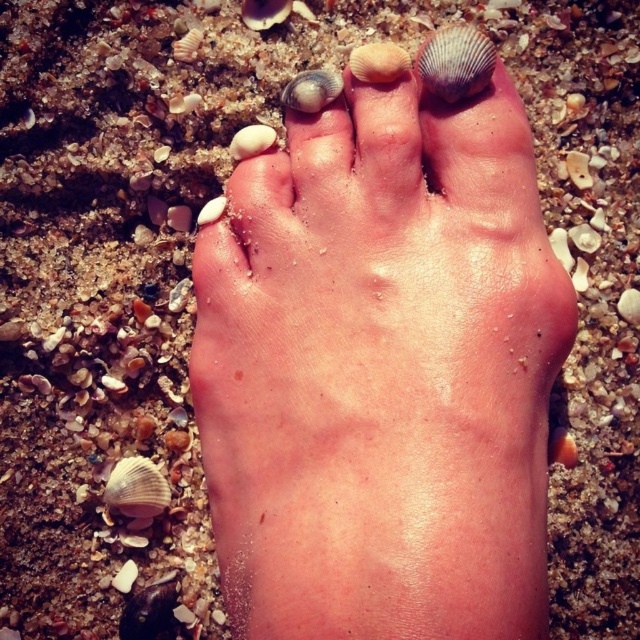
You are a photographer trying to capture the perfect shot of the foot on the sandy beach. You want to focus on the point at point (x=413, y=392). If your camera has a depth of field that can clearly capture objects within 15 inches from the camera, will the point be in focus?

The distance of point (x=413, y=392) from camera is 15.79 inches, which is slightly beyond the camera depth of field of 15 inches. Therefore, the point may not be in focus.

You are a lifeguard on duty at a beach. You notice a foot at the coordinates point [381,372]. Based on the scene description, what condition does this foot show?

The foot at point [381,372] shows dry skin as indicated by the description.